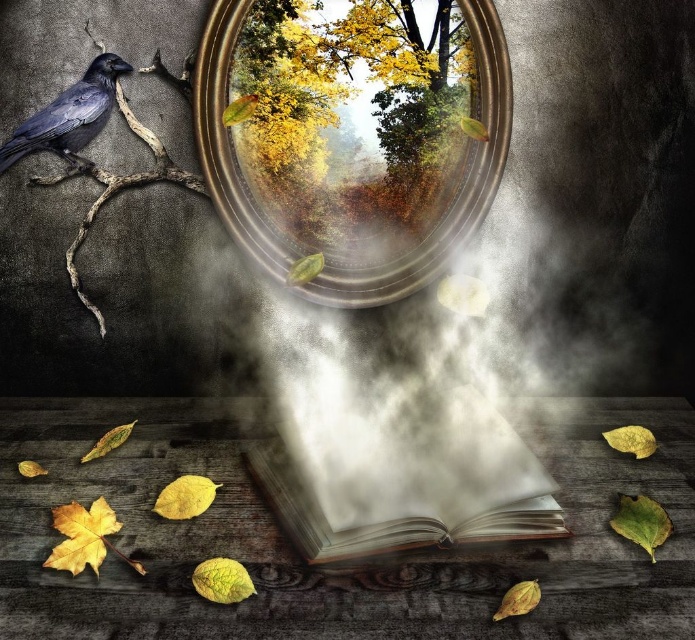
Question: Does wooden pages book at center appear over shiny black crow at upper left?

Choices:
 (A) yes
 (B) no

Answer: (B)

Question: Which point is farther from the camera taking this photo?

Choices:
 (A) (238, 19)
 (B) (402, 132)
 (C) (65, 112)

Answer: (B)

Question: Does yellow leafy tree at upper center have a lesser width compared to metallic reflective mirror at center?

Choices:
 (A) no
 (B) yes

Answer: (B)

Question: Does yellow leafy tree at upper center have a smaller size compared to wooden pages book at center?

Choices:
 (A) no
 (B) yes

Answer: (B)

Question: Which point is farther from the camera taking this photo?

Choices:
 (A) (343, 45)
 (B) (284, 481)
 (C) (227, 35)
 (D) (8, 141)

Answer: (A)

Question: Which of the following is the farthest from the observer?

Choices:
 (A) [414, 54]
 (B) [300, 481]
 (C) [56, 125]
 (D) [466, 13]

Answer: (A)